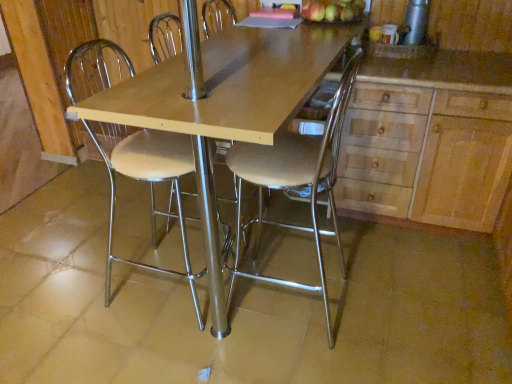
In order to click on unoccupied area behind metallic silver stool at center, which is the second chair in right-to-left order in this screenshot , I will do `click(173, 229)`.